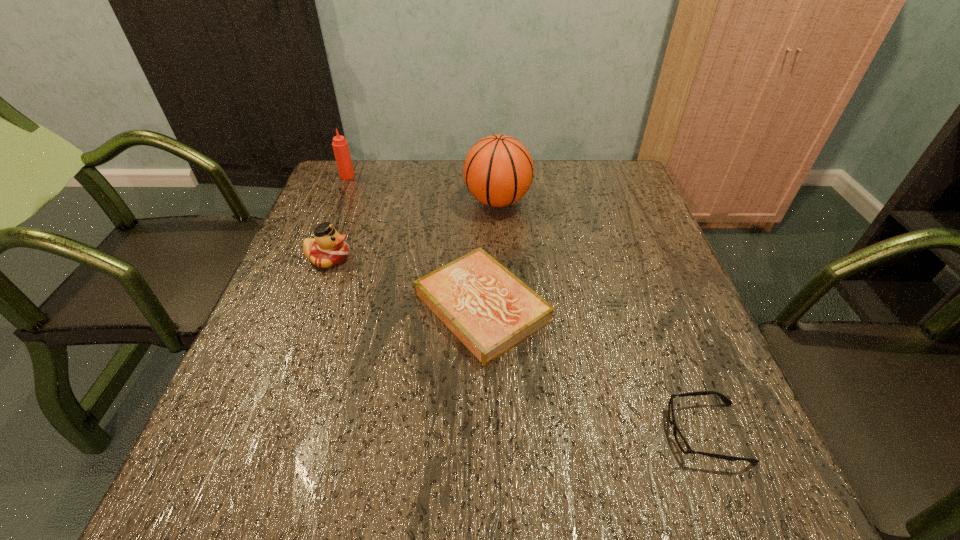
Identify the location of object that is at the right edge. This screenshot has height=540, width=960. (680, 440).

This screenshot has height=540, width=960. I want to click on object present at the far left corner, so click(x=340, y=146).

The width and height of the screenshot is (960, 540). I want to click on object that is at the near right corner, so click(680, 440).

This screenshot has width=960, height=540. In the image, there is a desktop. Find the location of `vacant space at the far edge`. vacant space at the far edge is located at coordinates (426, 204).

The image size is (960, 540). In order to click on vacant region at the near edge of the desktop in this screenshot , I will do `click(302, 482)`.

In the image, there is a desktop. What are the coordinates of `free space at the left edge` in the screenshot? It's located at (322, 216).

What are the coordinates of `blank space at the right edge of the desktop` in the screenshot? It's located at (628, 212).

Locate an element on the screen. This screenshot has width=960, height=540. vacant space at the far left corner of the desktop is located at coordinates (371, 161).

The image size is (960, 540). I want to click on blank space at the far right corner of the desktop, so click(598, 178).

What are the coordinates of `vacant region at the near right corner` in the screenshot? It's located at (694, 464).